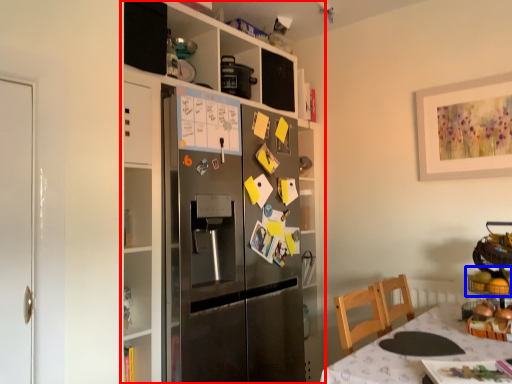
Question: Which object appears farthest to the camera in this image, cabinetry (highlighted by a red box) or food (highlighted by a blue box)?

Choices:
 (A) cabinetry
 (B) food

Answer: (A)